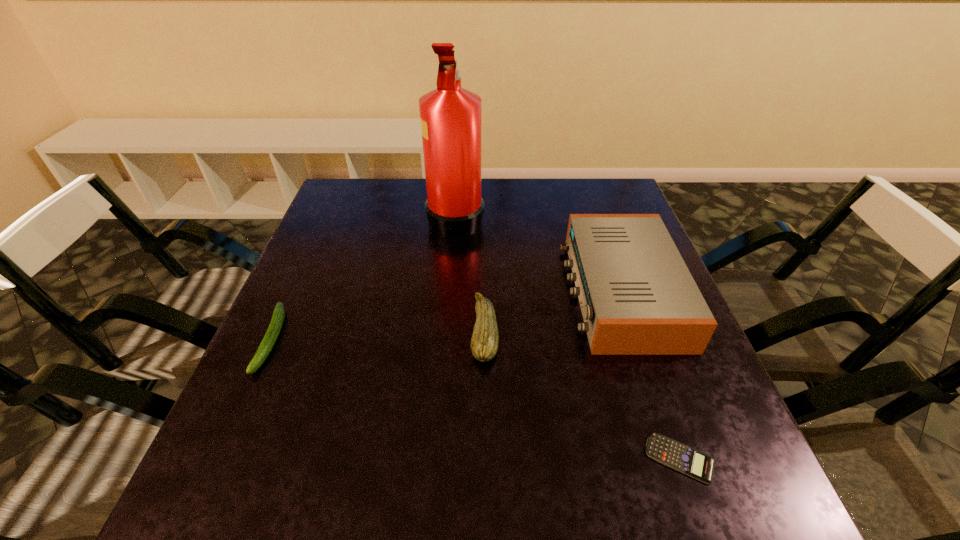
The width and height of the screenshot is (960, 540). Find the location of `free space located 0.360m on the front panel of the second tallest object`. free space located 0.360m on the front panel of the second tallest object is located at coordinates (415, 291).

The image size is (960, 540). In order to click on vacant point located on the front panel of the second tallest object in this screenshot , I will do `click(483, 291)`.

Where is `vacant space located at the stem end of the taller zucchini`? This screenshot has height=540, width=960. vacant space located at the stem end of the taller zucchini is located at coordinates click(298, 330).

This screenshot has width=960, height=540. In order to click on free location located at the stem end of the taller zucchini in this screenshot , I will do `click(284, 330)`.

What are the coordinates of `free space located at the stem end of the taller zucchini` in the screenshot? It's located at (392, 330).

The image size is (960, 540). In order to click on vacant region located on the front-facing side of the left zucchini in this screenshot , I will do `click(204, 489)`.

Where is `vacant space situated 0.220m on the back of the calculator`? This screenshot has width=960, height=540. vacant space situated 0.220m on the back of the calculator is located at coordinates (637, 336).

At what (x,y) coordinates should I click in order to perform the action: click on object situated at the far edge. Please return your answer as a coordinate pair (x, y). Looking at the image, I should click on (450, 115).

This screenshot has height=540, width=960. In order to click on object located in the near edge section of the desktop in this screenshot , I will do `click(678, 456)`.

This screenshot has width=960, height=540. Find the location of `object that is at the left edge`. object that is at the left edge is located at coordinates (272, 333).